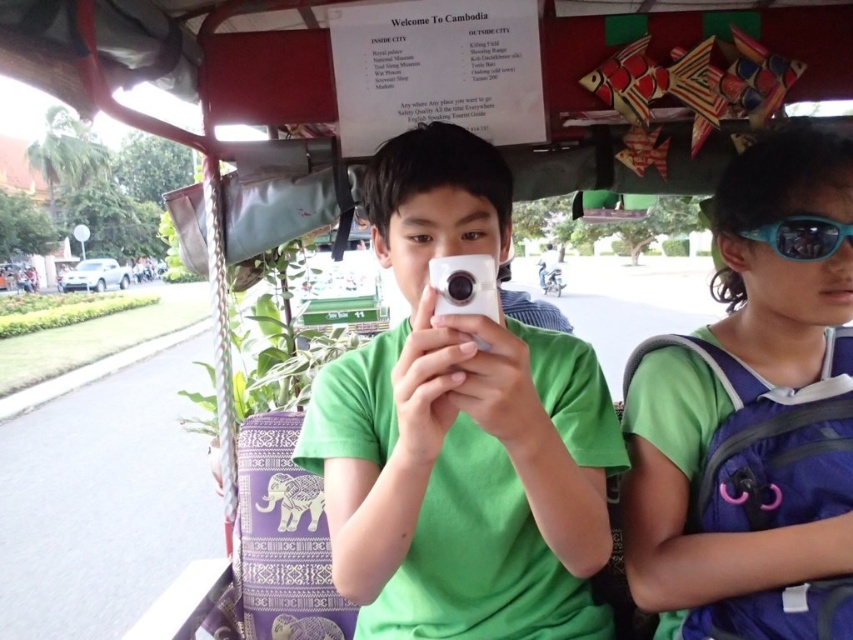
Question: Which object appears farthest from the camera in this image?

Choices:
 (A) blue reflective lens at upper right
 (B) white plastic camera at center
 (C) green matte shirt at center

Answer: (A)

Question: Is green matte shirt at center above green fabric backpack at center?

Choices:
 (A) yes
 (B) no

Answer: (B)

Question: Does green fabric backpack at center lie behind white plastic camera at center?

Choices:
 (A) yes
 (B) no

Answer: (A)

Question: Which of the following is the closest to the observer?

Choices:
 (A) green fabric backpack at center
 (B) green matte shirt at center

Answer: (B)

Question: Can you confirm if green matte shirt at center is smaller than white plastic camera at center?

Choices:
 (A) yes
 (B) no

Answer: (B)

Question: Which point is closer to the camera?

Choices:
 (A) (492, 328)
 (B) (830, 280)
 (C) (477, 266)
 (D) (741, 228)

Answer: (A)